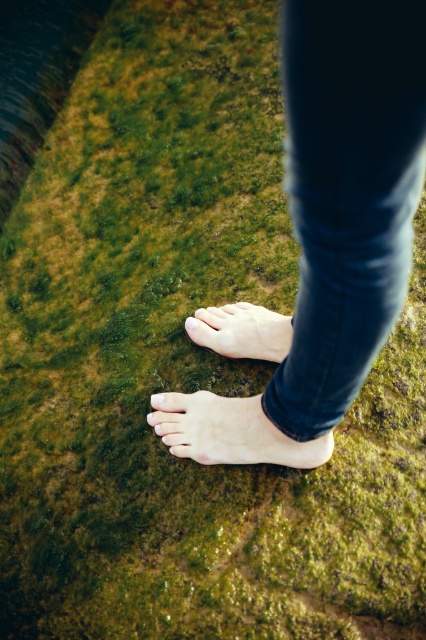
Which is more to the left, smooth skin foot at center or pale skin foot at center?

From the viewer's perspective, smooth skin foot at center appears more on the left side.

Does smooth skin foot at center appear over pale skin foot at center?

No.

This screenshot has width=426, height=640. Identify the location of smooth skin foot at center. click(x=230, y=432).

Does smooth skin foot at center have a greater height compared to white matte toe at center?

Yes.

Which of these two, smooth skin foot at center or white matte toe at center, stands shorter?

white matte toe at center

Locate an element on the screen. This screenshot has width=426, height=640. smooth skin foot at center is located at coordinates (230, 432).

Does dark blue denim jeans at center have a lesser height compared to pale skin foot at center?

Incorrect, dark blue denim jeans at center's height does not fall short of pale skin foot at center's.

Is dark blue denim jeans at center positioned in front of pale skin foot at center?

Yes, it is in front of pale skin foot at center.

Image resolution: width=426 pixels, height=640 pixels. I want to click on dark blue denim jeans at center, so click(347, 193).

What are the coordinates of `dark blue denim jeans at center` in the screenshot? It's located at (347, 193).